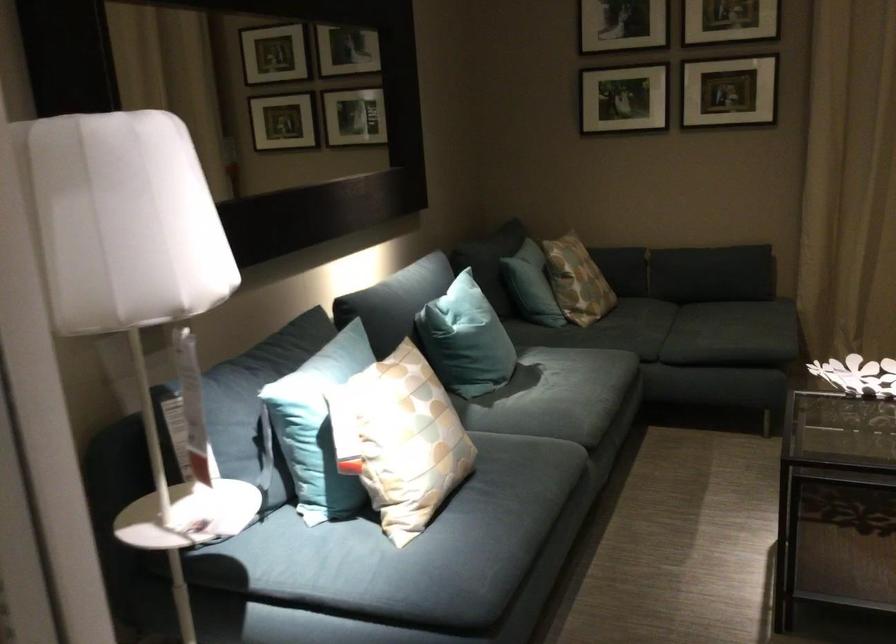
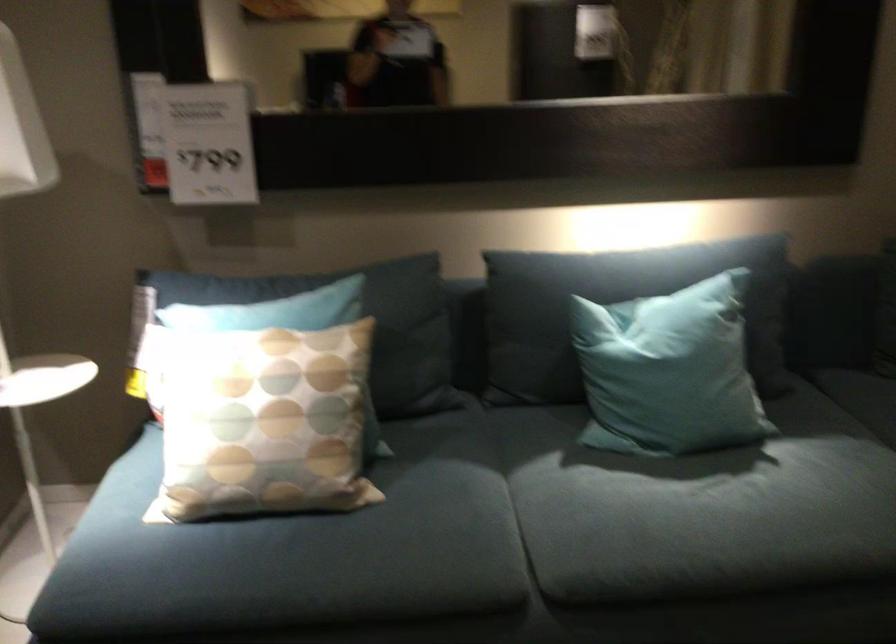
The point at (431, 427) is marked in the first image. Where is the corresponding point in the second image?

(263, 422)